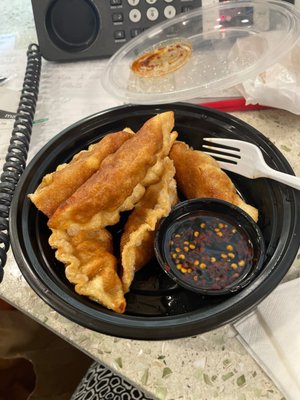
You are a GUI agent. You are given a task and a screenshot of the screen. Output one action in this format:
    pyautogui.click(x=<x>, y=<y>)
    Task: Click on the plastic lid for food container
    Image resolution: width=300 pixels, height=400 pixels.
    Given the screenshot: What is the action you would take?
    (165, 56), (239, 49)